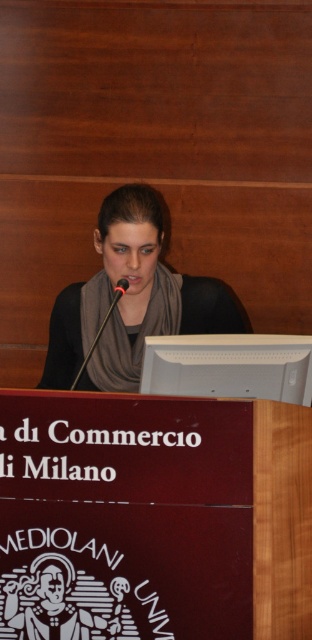
Does matte gray scarf at center lie behind black matte microphone at center?

Yes, it is.

Is point (63, 378) positioned before point (117, 298)?

No, it is not.

Which is behind, point (131, 333) or point (126, 289)?

Positioned behind is point (131, 333).

Identify the location of matte gray scarf at center. This screenshot has height=640, width=312. (130, 300).

Is black plastic microphone at center below black matte microphone at center?

Yes, black plastic microphone at center is below black matte microphone at center.

Between black plastic microphone at center and black matte microphone at center, which one appears on the right side from the viewer's perspective?

From the viewer's perspective, black matte microphone at center appears more on the right side.

Describe the element at coordinates (102, 326) in the screenshot. Image resolution: width=312 pixels, height=640 pixels. I see `black plastic microphone at center` at that location.

Locate an element on the screen. This screenshot has height=640, width=312. black plastic microphone at center is located at coordinates (102, 326).

Is matte gray scarf at center positioned behind black plastic microphone at center?

That is True.

Between point (82, 358) and point (116, 298), which one is positioned in front?

Point (116, 298) is in front.

Find the location of a particular element. The image size is (312, 640). matte gray scarf at center is located at coordinates pos(130,300).